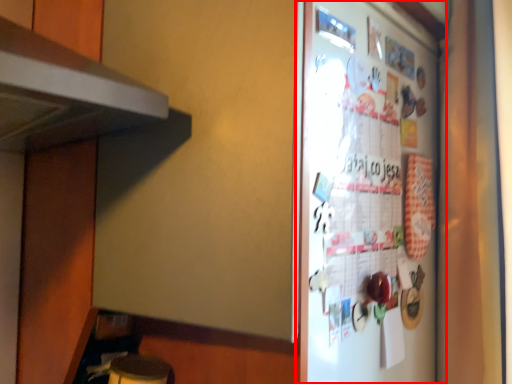
Question: From the image's perspective, considering the relative positions of refrigerator (annotated by the red box) and curtain in the image provided, where is refrigerator (annotated by the red box) located with respect to the staircase?

Choices:
 (A) below
 (B) above

Answer: (A)